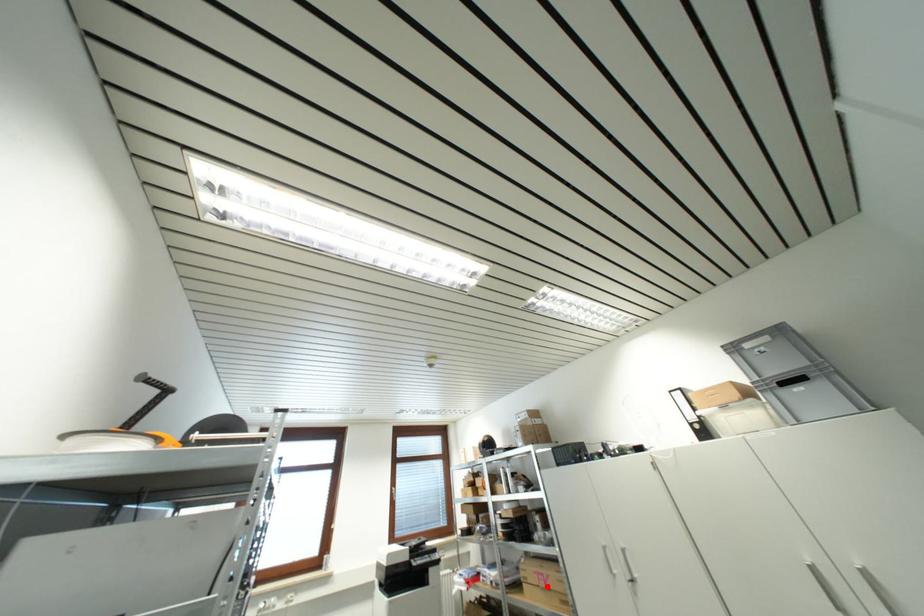
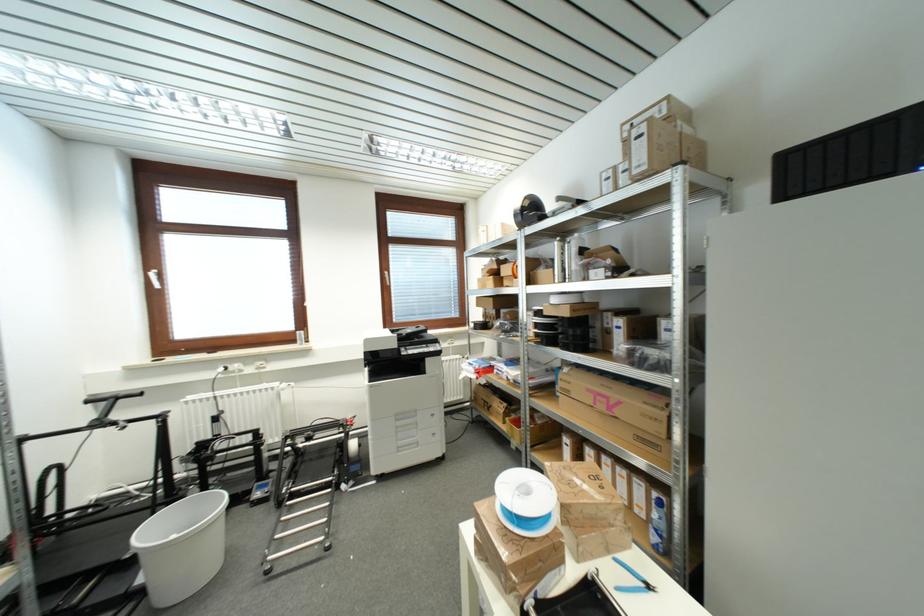
In the second image, find the point that corresponds to the highlighted location in the first image.

(605, 408)